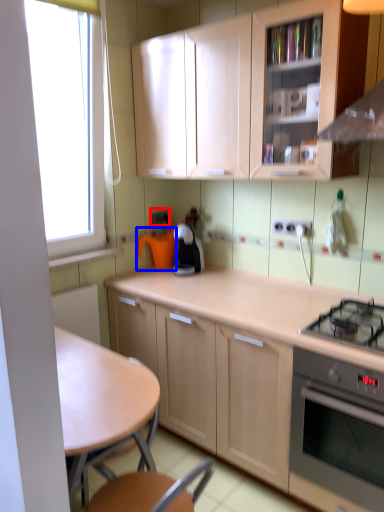
Question: Which point is closer to the camera, electric outlet (highlighted by a red box) or appliance (highlighted by a blue box)?

Choices:
 (A) electric outlet
 (B) appliance

Answer: (B)